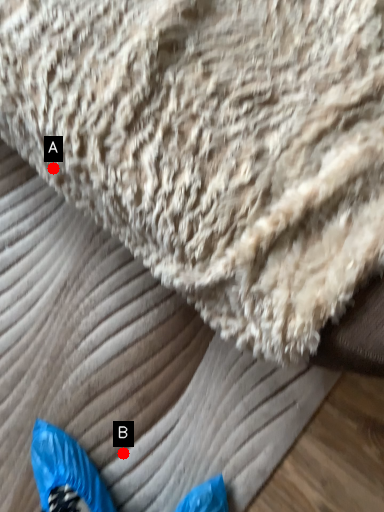
Question: Two points are circled on the image, labeled by A and B beside each circle. Which point is further to the camera?

Choices:
 (A) A is further
 (B) B is further

Answer: (B)